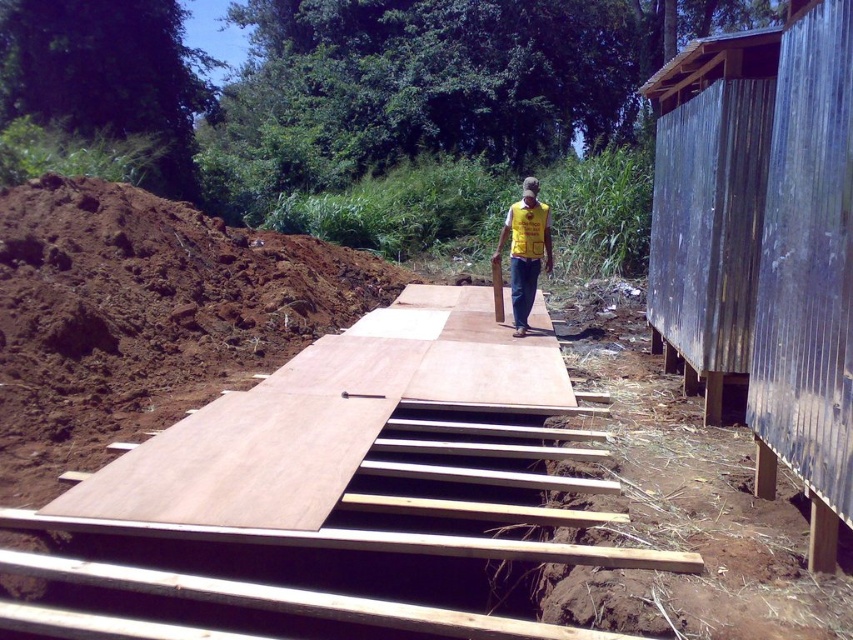
Is metallic corrugated hut at right in front of yellow fabric vest at center?

Yes, it is in front of yellow fabric vest at center.

Which is above, metallic corrugated hut at right or yellow fabric vest at center?

yellow fabric vest at center is above.

Is point (753, 188) farther from camera compared to point (519, 220)?

No, (753, 188) is in front of (519, 220).

What are the coordinates of `metallic corrugated hut at right` in the screenshot? It's located at (763, 241).